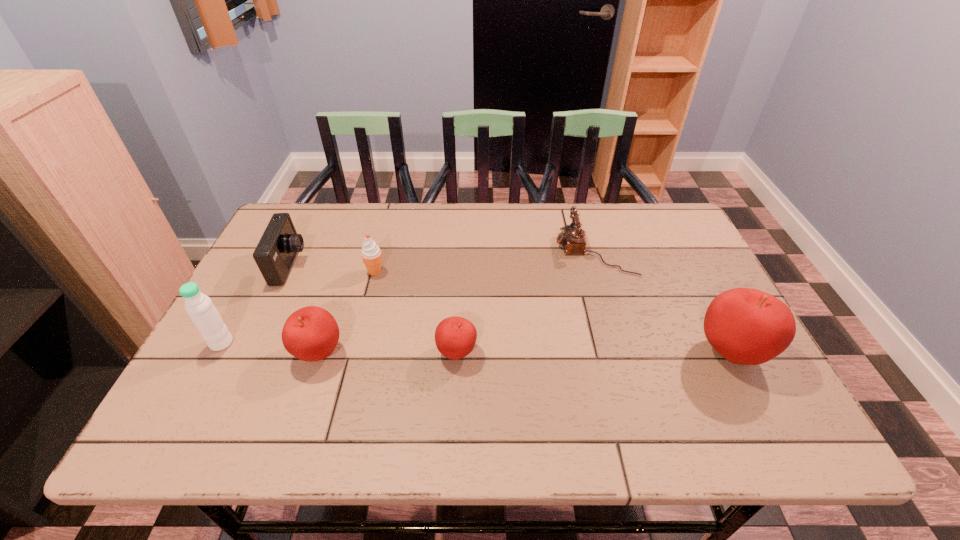
I want to click on blank area at the near right corner, so click(x=714, y=386).

The height and width of the screenshot is (540, 960). Find the location of `vacant area that lies between the leftmost apple and the second object from right to left`. vacant area that lies between the leftmost apple and the second object from right to left is located at coordinates (457, 302).

Identify the location of free point between the water bottle and the leftmost apple. The width and height of the screenshot is (960, 540). (271, 348).

Image resolution: width=960 pixels, height=540 pixels. Find the location of `free space between the second object from left to right and the water bottle`. free space between the second object from left to right and the water bottle is located at coordinates (256, 305).

Where is `empty space that is in between the leftmost object and the telephone`? The height and width of the screenshot is (540, 960). empty space that is in between the leftmost object and the telephone is located at coordinates (408, 298).

Where is `unoccupied position between the water bottle and the second apple from right to left`? unoccupied position between the water bottle and the second apple from right to left is located at coordinates click(339, 348).

Find the location of a particular element. This screenshot has height=540, width=960. unoccupied position between the water bottle and the rightmost object is located at coordinates (476, 347).

The width and height of the screenshot is (960, 540). I want to click on vacant space that's between the leftmost object and the second apple from left to right, so [x=339, y=348].

Locate an element on the screen. free space that is in between the second tallest apple and the telephone is located at coordinates (457, 302).

In order to click on free space between the second tallest apple and the rightmost apple in this screenshot , I will do `click(525, 353)`.